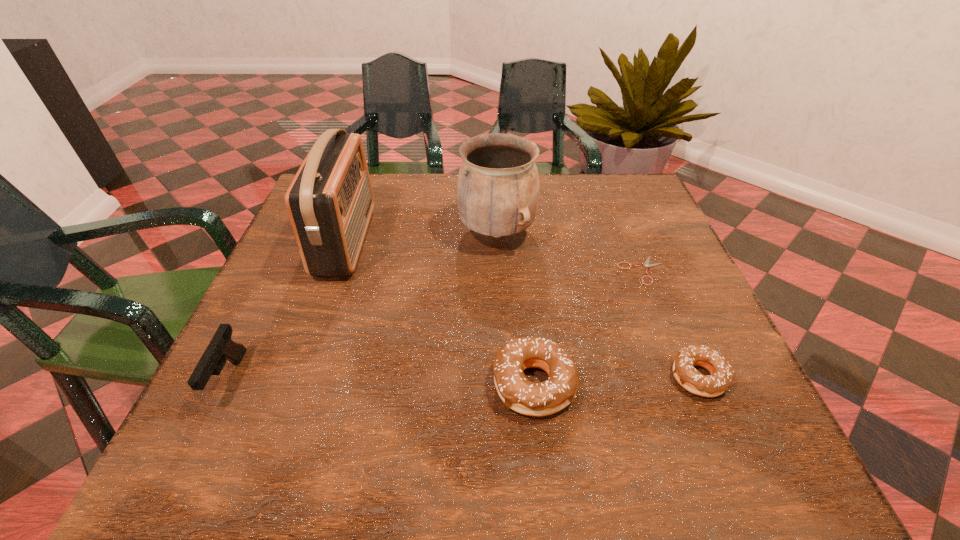
Find the location of a particular element. The width and height of the screenshot is (960, 540). the taller doughnut is located at coordinates (545, 398).

This screenshot has width=960, height=540. What are the coordinates of `the left doughnut` in the screenshot? It's located at (545, 398).

Locate an element on the screen. This screenshot has height=540, width=960. the second shortest object is located at coordinates (721, 371).

Where is `the shorter doughnut`? This screenshot has width=960, height=540. the shorter doughnut is located at coordinates (721, 371).

You are a GUI agent. You are given a task and a screenshot of the screen. Output one action in this format:
    pyautogui.click(x=<x>, y=<y>)
    Task: Click on the urn
    The image size is (960, 540).
    Given the screenshot: What is the action you would take?
    pyautogui.click(x=498, y=188)

I want to click on the fifth object from right to left, so click(x=330, y=201).

Locate an element on the screen. This screenshot has height=540, width=960. the shortest object is located at coordinates click(x=647, y=265).

Find the location of `the third tallest object`. the third tallest object is located at coordinates (221, 347).

Where is `pistol`? pistol is located at coordinates 221,347.

Locate an element on the screen. free space located on the back of the third shortest object is located at coordinates (518, 234).